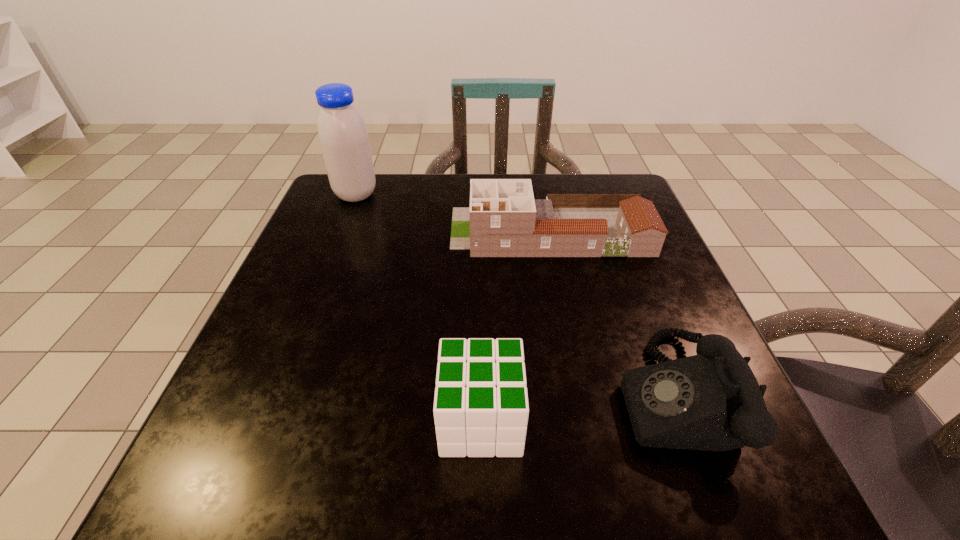
This screenshot has height=540, width=960. I want to click on vacant region located on the red face of the cube, so click(360, 420).

I want to click on vacant space located 0.120m on the red face of the cube, so point(360,420).

In order to click on free region located on the red face of the cube in this screenshot , I will do `click(395, 420)`.

At what (x,y) coordinates should I click in order to perform the action: click on free space located on the dial of the telephone. Please return your answer as a coordinate pair (x, y). This screenshot has width=960, height=540. Looking at the image, I should click on (415, 394).

Where is `vacant space situated 0.200m on the dial of the telephone`? This screenshot has width=960, height=540. vacant space situated 0.200m on the dial of the telephone is located at coordinates (492, 394).

Find the location of a particular element. The height and width of the screenshot is (540, 960). vacant space located 0.190m on the dial of the telephone is located at coordinates (498, 394).

Find the location of a particular element. soya milk located in the far edge section of the desktop is located at coordinates [x=343, y=136].

Locate an element on the screen. dollhouse present at the far edge is located at coordinates (503, 220).

Find the location of a particular element. The width and height of the screenshot is (960, 540). cube that is positioned at the near edge is located at coordinates (481, 408).

I want to click on telephone that is positioned at the near edge, so click(712, 401).